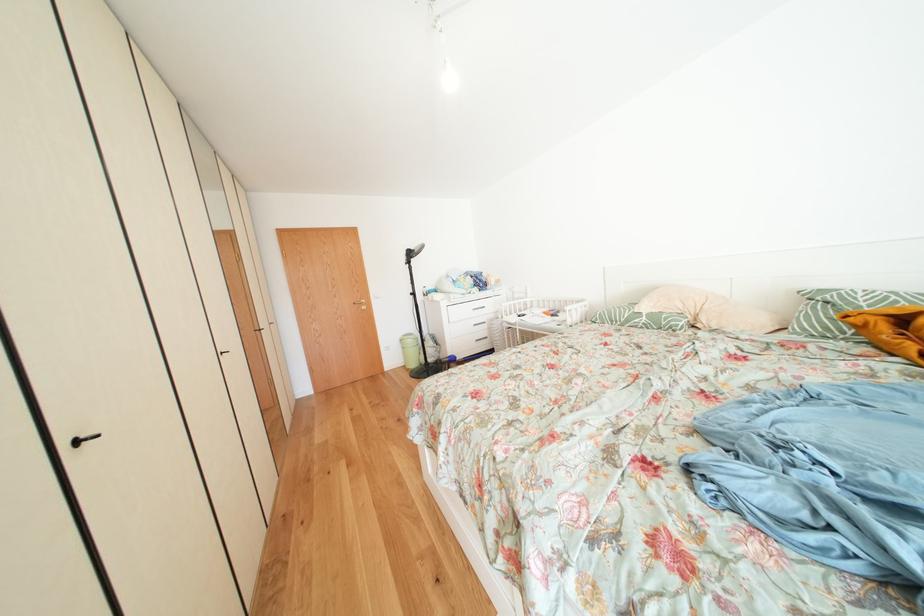
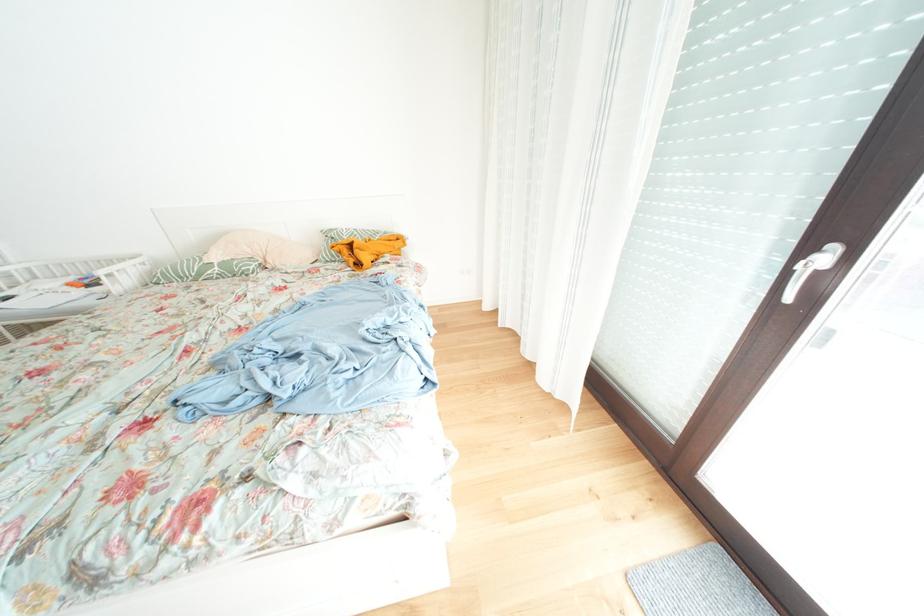
The first image is from the beginning of the video and the second image is from the end. How did the camera likely rotate when shooting the video?

The rotation direction of the camera is right-down.